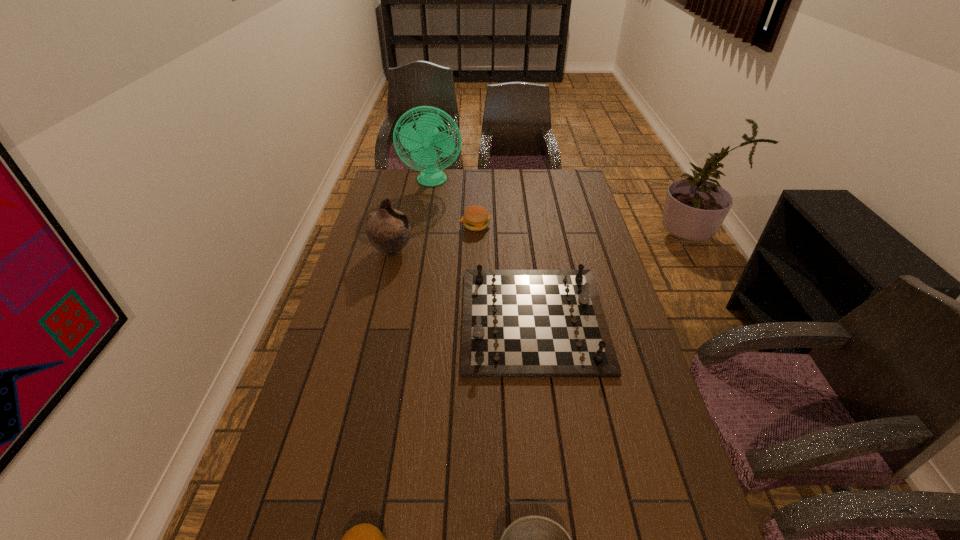
The width and height of the screenshot is (960, 540). Identify the location of vacant region located on the board of the third nearest object. (390, 320).

Image resolution: width=960 pixels, height=540 pixels. Identify the location of vacant area located on the board of the third nearest object. (437, 320).

Find the location of `vacant area situated on the right of the right hamburger`. vacant area situated on the right of the right hamburger is located at coordinates point(563,226).

The height and width of the screenshot is (540, 960). Identify the location of object present at the far edge. (426, 135).

Find the location of a particular element. fan that is at the left edge is located at coordinates (x=426, y=135).

This screenshot has width=960, height=540. I want to click on pottery that is at the left edge, so click(388, 230).

Locate an element on the screen. object present at the right edge is located at coordinates (516, 323).

You are a GUI agent. You are given a task and a screenshot of the screen. Output one action in this format:
    pyautogui.click(x=<x>, y=<y>)
    Task: Click on the object located at the far left corner
    Image resolution: width=960 pixels, height=540 pixels.
    Given the screenshot: What is the action you would take?
    pyautogui.click(x=426, y=135)

Locate an element on the screen. free space at the far edge of the desktop is located at coordinates 525,196.

The image size is (960, 540). In the image, there is a desktop. Find the location of `vacant space at the left edge`. vacant space at the left edge is located at coordinates (320, 411).